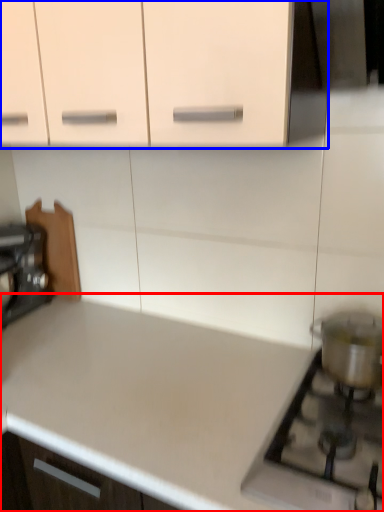
Question: Which point is closer to the camera, countertop (highlighted by a red box) or cabinetry (highlighted by a blue box)?

Choices:
 (A) countertop
 (B) cabinetry

Answer: (A)